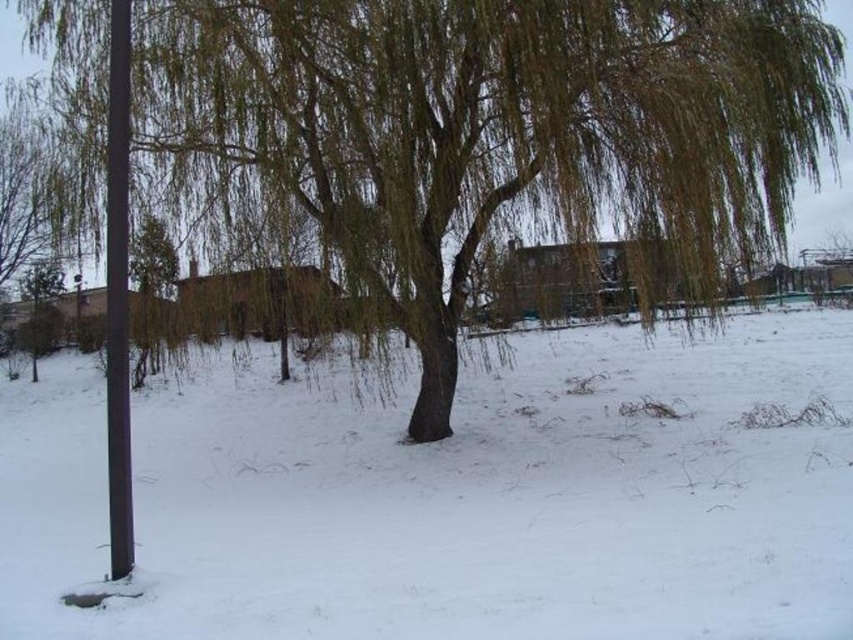
Question: Which object is farther from the camera taking this photo?

Choices:
 (A) white fluffy snow at lower left
 (B) smooth black pole at left

Answer: (B)

Question: Which point appears farthest from the camera in this image?

Choices:
 (A) (126, 545)
 (B) (283, 93)
 (C) (407, 468)

Answer: (C)

Question: Is white fluffy snow at lower left to the left of smooth black pole at left from the viewer's perspective?

Choices:
 (A) yes
 (B) no

Answer: (B)

Question: Which object is closer to the camera taking this photo?

Choices:
 (A) brown textured willow at center
 (B) green leafy tree at center
 (C) white fluffy snow at lower left
 (D) smooth black pole at left

Answer: (C)

Question: Is brown textured willow at center wider than smooth black pole at left?

Choices:
 (A) no
 (B) yes

Answer: (B)

Question: Is white fluffy snow at lower left thinner than brown textured willow at center?

Choices:
 (A) yes
 (B) no

Answer: (B)